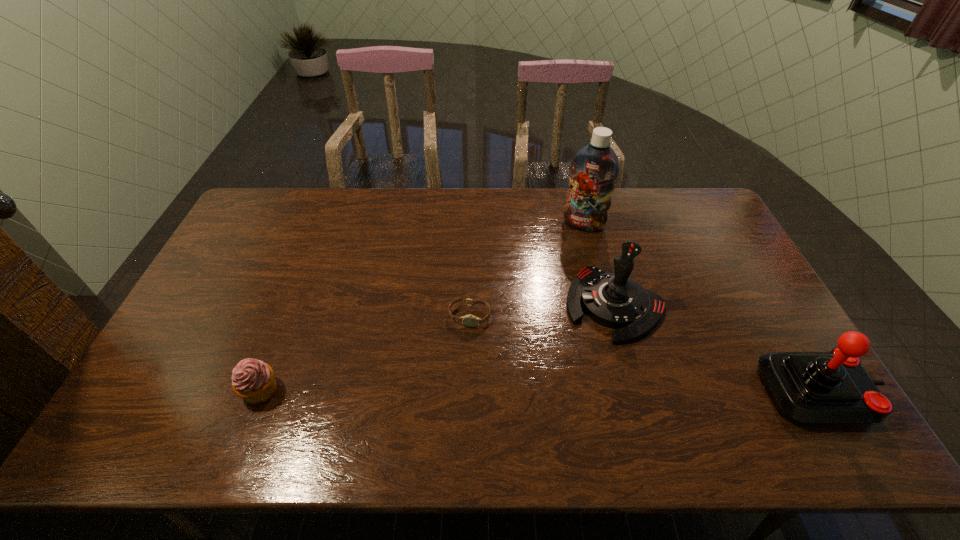
Find the location of `vacant space positioned 0.270m on the front label of the farthest object`. vacant space positioned 0.270m on the front label of the farthest object is located at coordinates (555, 285).

Identify the location of blank space located on the front label of the farthest object. This screenshot has width=960, height=540. (563, 266).

The image size is (960, 540). Identify the location of vacant space situated 0.230m on the front label of the farthest object. (558, 276).

Locate an element on the screen. The image size is (960, 540). blank area located 0.240m on the handle side of the farther joystick is located at coordinates (552, 402).

The height and width of the screenshot is (540, 960). What are the coordinates of `free location located on the handle side of the farther joystick` in the screenshot? It's located at (571, 373).

This screenshot has height=540, width=960. In order to click on vacant space located on the handle side of the farther joystick in this screenshot , I will do 574,368.

You are a GUI agent. You are given a task and a screenshot of the screen. Output one action in this format:
    pyautogui.click(x=<x>, y=<y>)
    Task: Click on the blank area located 0.140m on the face of the shortest object
    
    Given the screenshot: What is the action you would take?
    pyautogui.click(x=459, y=371)

At what (x,y) coordinates should I click in order to perform the action: click on free space located on the face of the shortest object. Please return your answer as a coordinate pair (x, y). Looking at the image, I should click on click(x=462, y=355).

I want to click on vacant region located on the face of the shortest object, so click(463, 352).

Find the location of a particular element. This screenshot has width=960, height=540. object present at the far edge is located at coordinates (594, 168).